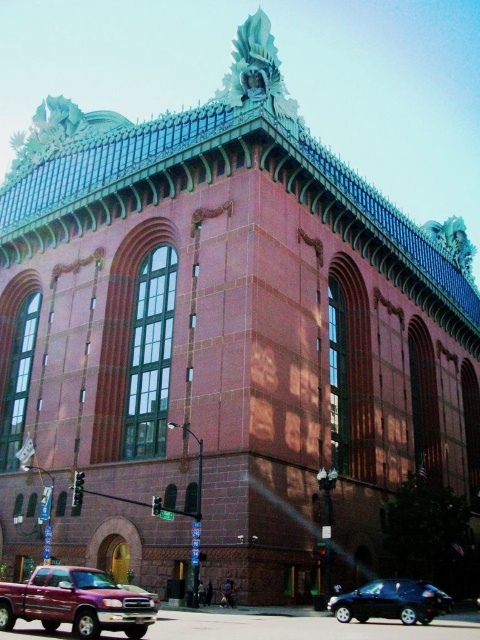
Question: Which of the following is the closest to the observer?

Choices:
 (A) (337, 618)
 (B) (31, 582)

Answer: (B)

Question: Which of the following is the closest to the observer?

Choices:
 (A) metallic maroon pickup truck at lower left
 (B) shiny black car at lower right

Answer: (A)

Question: Can you confirm if metallic maroon pickup truck at lower left is bigger than shiny black car at lower right?

Choices:
 (A) yes
 (B) no

Answer: (A)

Question: Is metallic maroon pickup truck at lower left below shiny black car at lower right?

Choices:
 (A) yes
 (B) no

Answer: (B)

Question: Is metallic maroon pickup truck at lower left to the right of shiny black car at lower right from the viewer's perspective?

Choices:
 (A) yes
 (B) no

Answer: (B)